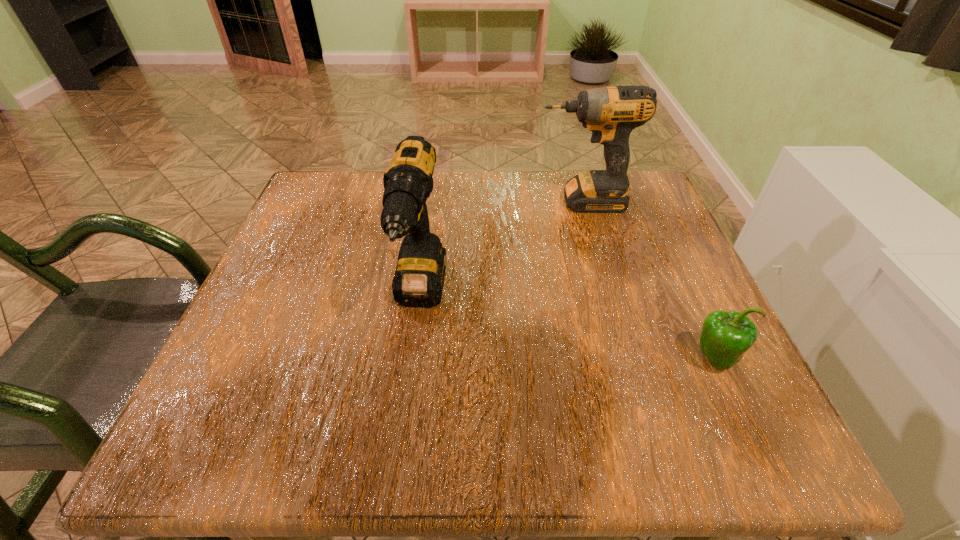
Where is `object at the far edge`? The width and height of the screenshot is (960, 540). object at the far edge is located at coordinates (611, 113).

The width and height of the screenshot is (960, 540). I want to click on drill located at the right edge, so click(611, 113).

At what (x,y) coordinates should I click in order to perform the action: click on bell pepper that is at the right edge. Please return your answer as a coordinate pair (x, y). This screenshot has width=960, height=540. Looking at the image, I should click on (725, 336).

This screenshot has width=960, height=540. In order to click on object present at the far right corner in this screenshot , I will do `click(611, 113)`.

Image resolution: width=960 pixels, height=540 pixels. Identify the location of vacant area at the far edge. (527, 185).

At what (x,y) coordinates should I click in order to perform the action: click on vacant space at the near edge of the desktop. Please return your answer as a coordinate pair (x, y). Looking at the image, I should click on (487, 432).

The height and width of the screenshot is (540, 960). I want to click on free region at the left edge of the desktop, so click(300, 234).

The width and height of the screenshot is (960, 540). In order to click on vacant space at the right edge in this screenshot , I will do `click(683, 307)`.

I want to click on free spot at the far left corner of the desktop, so click(x=334, y=208).

The image size is (960, 540). Identify the location of vacant region at the far right corner. (645, 173).